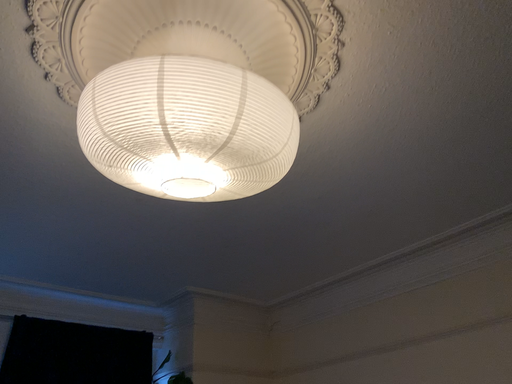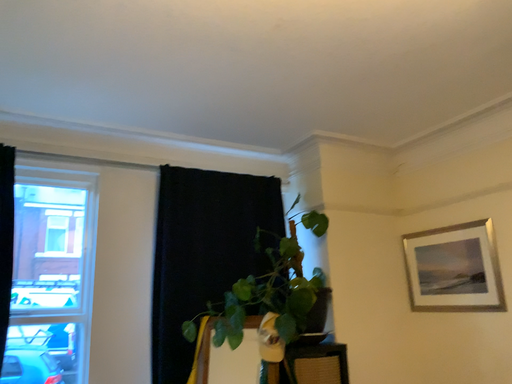
Question: Which way did the camera rotate in the video?

Choices:
 (A) rotated left
 (B) rotated right

Answer: (A)